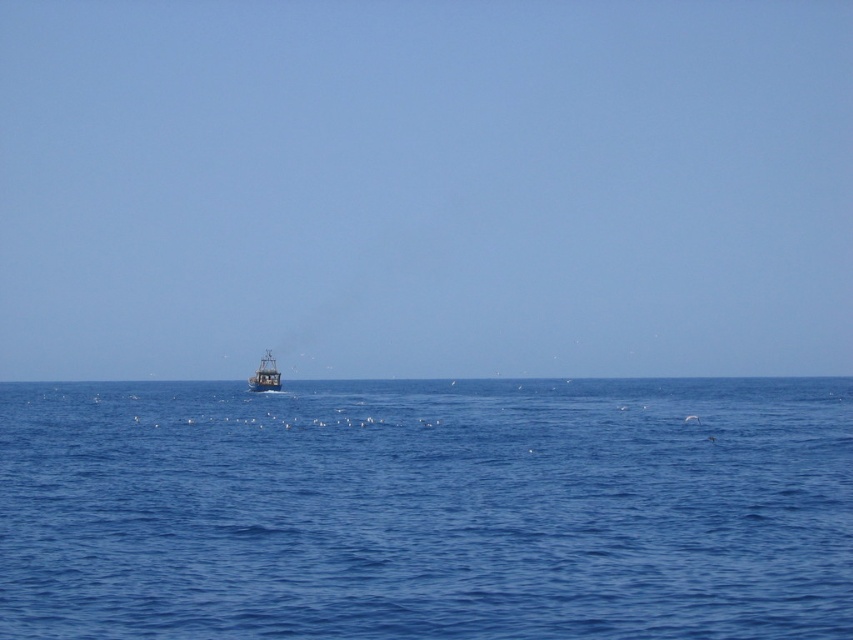
Question: Is blue liquid water at center to the right of metallic gray boat at center from the viewer's perspective?

Choices:
 (A) no
 (B) yes

Answer: (B)

Question: Is blue liquid water at center to the right of metallic gray boat at center from the viewer's perspective?

Choices:
 (A) no
 (B) yes

Answer: (B)

Question: Does blue liquid water at center appear under metallic gray boat at center?

Choices:
 (A) no
 (B) yes

Answer: (B)